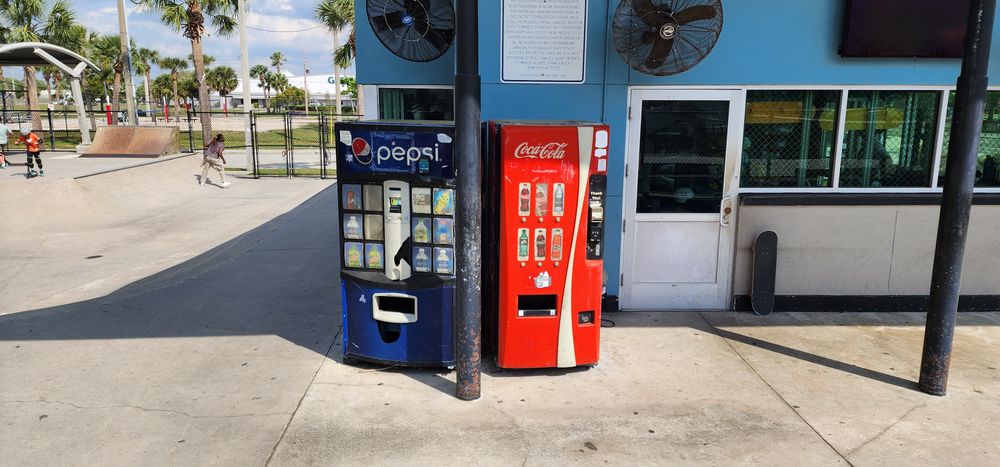
Locate an element on the screen. door is located at coordinates (694, 248).